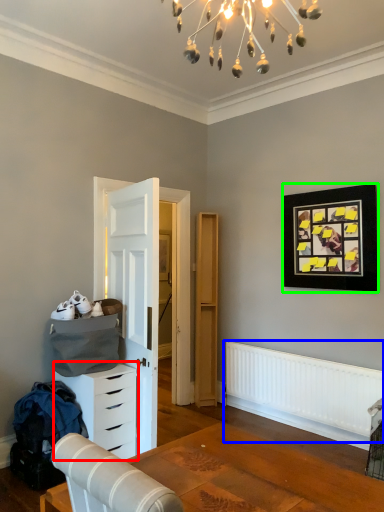
Question: Which object is the closest to the chest of drawers (highlighted by a red box)? Choose among these: radiator (highlighted by a blue box) or picture frame (highlighted by a green box).

Choices:
 (A) radiator
 (B) picture frame

Answer: (A)